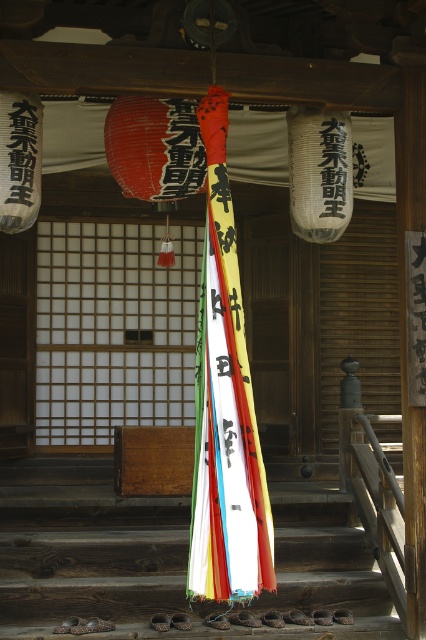
Is point (23, 515) farther from viewer compared to point (31, 109)?

Yes, it is.

Between wooden stairs at center and white paper lantern at upper left, which one is positioned higher?

Positioned higher is white paper lantern at upper left.

Between point (3, 465) and point (39, 164), which one is positioned behind?

Point (3, 465)

The height and width of the screenshot is (640, 426). Identify the location of wooden stairs at center. (169, 556).

Looking at this image, is red paper lantern at center taller than white paper lantern at center?

No, red paper lantern at center is not taller than white paper lantern at center.

Does red paper lantern at center lie in front of white paper lantern at center?

That is True.

At what (x,y) coordinates should I click in order to perform the action: click on red paper lantern at center. Please return your answer as a coordinate pair (x, y). This screenshot has height=640, width=426. Looking at the image, I should click on (155, 154).

Does white paper lantern at upper left have a greater height compared to black paper at center?

Correct, white paper lantern at upper left is much taller as black paper at center.

Which is more to the left, white paper lantern at upper left or black paper at center?

From the viewer's perspective, white paper lantern at upper left appears more on the left side.

I want to click on white paper lantern at upper left, so click(x=20, y=160).